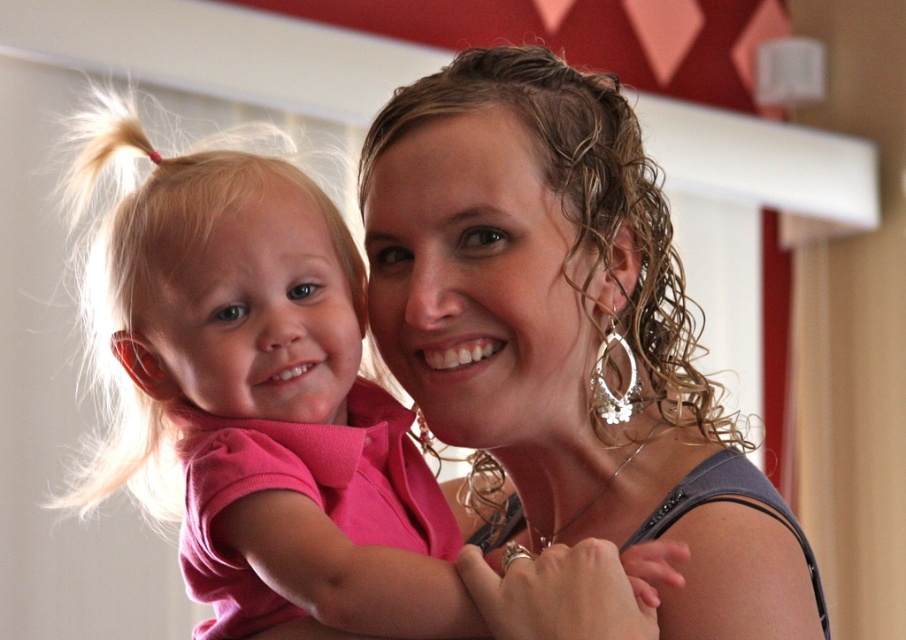
Who is higher up, matte pink shirt at center or pink fabric shirt at center?

matte pink shirt at center is higher up.

Is point (528, 256) in front of point (108, 131)?

Yes, it is in front of point (108, 131).

Locate an element on the screen. The width and height of the screenshot is (906, 640). matte pink shirt at center is located at coordinates (566, 333).